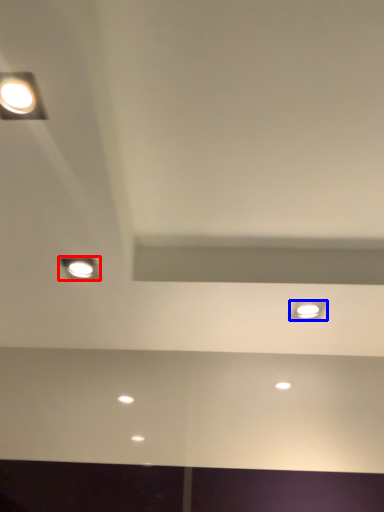
Question: Which of the following is the farthest to the observer, lamp (highlighted by a red box) or dot (highlighted by a blue box)?

Choices:
 (A) lamp
 (B) dot

Answer: (B)